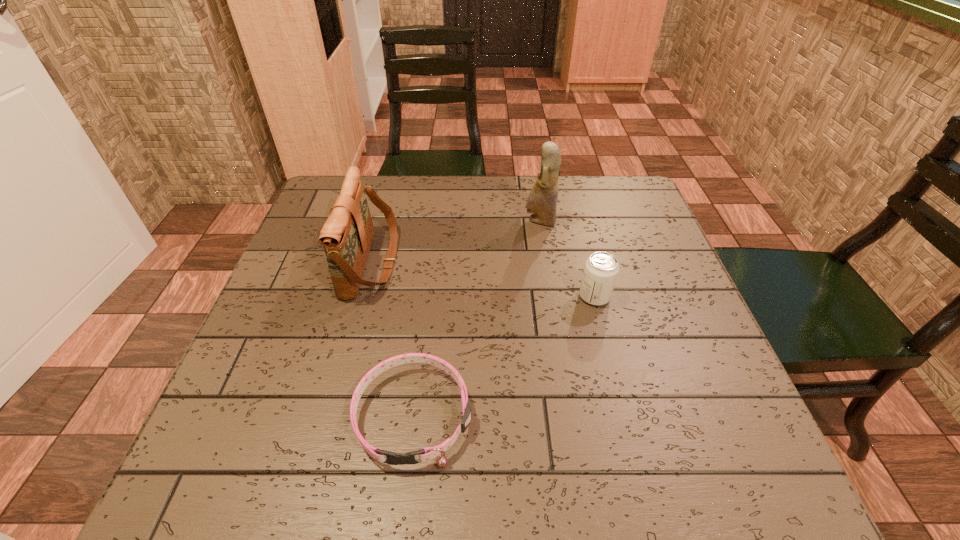
Find the location of a particular element. The image size is (960, 540). the tallest object is located at coordinates (542, 200).

The image size is (960, 540). What are the coordinates of `the second object from right to left` in the screenshot? It's located at (542, 200).

Where is `the second tallest object`? the second tallest object is located at coordinates (346, 236).

Identify the location of the second shortest object. Image resolution: width=960 pixels, height=540 pixels. (601, 269).

The image size is (960, 540). I want to click on the rightmost object, so click(x=601, y=269).

Where is `the shortest object`? The width and height of the screenshot is (960, 540). the shortest object is located at coordinates (425, 454).

Where is `the nearest object`? This screenshot has width=960, height=540. the nearest object is located at coordinates (425, 454).

At what (x,y) coordinates should I click in order to perform the action: click on free spot located 0.120m on the front-facing side of the tallest object. Please return your answer as a coordinate pair (x, y). This screenshot has width=960, height=540. Looking at the image, I should click on (478, 221).

At what (x,y) coordinates should I click in order to perform the action: click on vacant area situated on the front-facing side of the tallest object. Please return your answer as a coordinate pair (x, y). Looking at the image, I should click on (501, 221).

Identify the location of vacant space located 0.090m on the front-facing side of the tallest object. (490, 221).